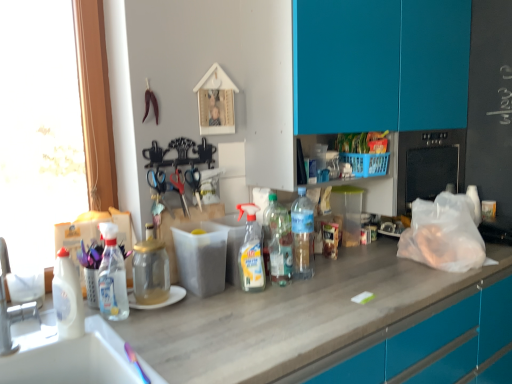
Question: Does transparent plastic spray bottle at left, positioned as the second bottle in left-to-right order, turn towards translucent plastic bottles at center, the 2th bottle viewed from the right?

Choices:
 (A) yes
 (B) no

Answer: (B)

Question: Would you say translucent plastic bottles at center, which appears as the fifth bottle when viewed from the left, is part of transparent plastic spray bottle at left, positioned as the second bottle in left-to-right order,'s contents?

Choices:
 (A) no
 (B) yes

Answer: (A)

Question: From a real-world perspective, is transparent plastic spray bottle at left, positioned as the second bottle in left-to-right order, positioned over translucent plastic bottles at center, the 2th bottle viewed from the right, based on gravity?

Choices:
 (A) no
 (B) yes

Answer: (A)

Question: Is transparent plastic spray bottle at left, positioned as the second bottle in left-to-right order, looking in the opposite direction of translucent plastic bottles at center, the 2th bottle viewed from the right?

Choices:
 (A) no
 (B) yes

Answer: (A)

Question: Is transparent plastic spray bottle at left, arranged as the 5th bottle when viewed from the right, further to the viewer compared to translucent plastic bottles at center, the 2th bottle viewed from the right?

Choices:
 (A) yes
 (B) no

Answer: (B)

Question: Is red plastic scissors at center, arranged as the 2th scissors when viewed from the left, in front of or behind brushed metal faucet at lower left in the image?

Choices:
 (A) front
 (B) behind

Answer: (B)

Question: Is red plastic scissors at center, the second scissors positioned from the right, taller or shorter than brushed metal faucet at lower left?

Choices:
 (A) tall
 (B) short

Answer: (B)

Question: In terms of width, does red plastic scissors at center, the second scissors positioned from the right, look wider or thinner when compared to brushed metal faucet at lower left?

Choices:
 (A) wide
 (B) thin

Answer: (B)

Question: From the image's perspective, is red plastic scissors at center, arranged as the 2th scissors when viewed from the left, above or below brushed metal faucet at lower left?

Choices:
 (A) below
 (B) above

Answer: (B)

Question: Considering the positions of translucent plastic spray bottle at center, the third bottle viewed from the right, and transparent plastic spray bottle at left, positioned as the second bottle in left-to-right order, in the image, is translucent plastic spray bottle at center, the third bottle viewed from the right, bigger or smaller than transparent plastic spray bottle at left, positioned as the second bottle in left-to-right order,?

Choices:
 (A) big
 (B) small

Answer: (B)

Question: Would you say translucent plastic spray bottle at center, placed as the 4th bottle when sorted from left to right, is to the left or to the right of transparent plastic spray bottle at left, arranged as the 5th bottle when viewed from the right, in the picture?

Choices:
 (A) right
 (B) left

Answer: (A)

Question: From the image's perspective, relative to transparent plastic spray bottle at left, arranged as the 5th bottle when viewed from the right, is translucent plastic spray bottle at center, the third bottle viewed from the right, above or below?

Choices:
 (A) above
 (B) below

Answer: (A)

Question: Considering their positions, is translucent plastic spray bottle at center, placed as the 4th bottle when sorted from left to right, located in front of or behind transparent plastic spray bottle at left, arranged as the 5th bottle when viewed from the right?

Choices:
 (A) behind
 (B) front

Answer: (A)

Question: In terms of size, does white glossy bottle at left, which is the sixth bottle from right to left, appear bigger or smaller than brushed metal faucet at lower left?

Choices:
 (A) big
 (B) small

Answer: (B)

Question: Considering the positions of white glossy bottle at left, the first bottle from the left, and brushed metal faucet at lower left in the image, is white glossy bottle at left, the first bottle from the left, wider or thinner than brushed metal faucet at lower left?

Choices:
 (A) thin
 (B) wide

Answer: (A)